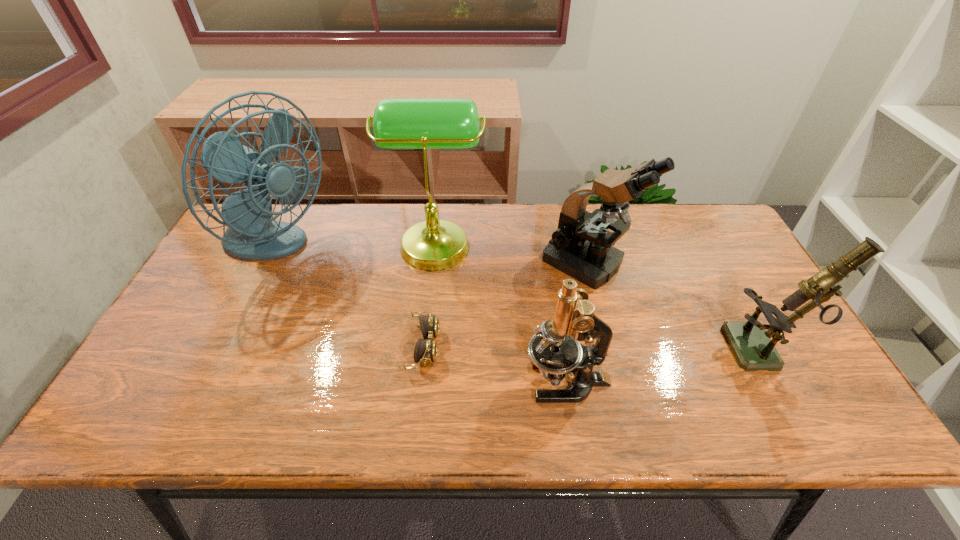
Select which microscope appears as the second closest to the farthest microscope. Please provide its 2D coordinates. Your answer should be formatted as a tuple, i.e. [(x, y)], where the tuple contains the x and y coordinates of a point satisfying the conditions above.

[(554, 349)]

Select which microscope is the second closest to the farthest microscope. Please provide its 2D coordinates. Your answer should be formatted as a tuple, i.e. [(x, y)], where the tuple contains the x and y coordinates of a point satisfying the conditions above.

[(554, 349)]

What are the coordinates of `blank area in the image that satisfies the following two spatial constraints: 1. in front of the leftmost object to blow air; 2. on the left side of the farthest microscope` in the screenshot? It's located at (269, 264).

Locate an element on the screen. The width and height of the screenshot is (960, 540). free spot that satisfies the following two spatial constraints: 1. on the desk next to the lamp; 2. on the right side of the farthest microscope is located at coordinates (433, 264).

You are a GUI agent. You are given a task and a screenshot of the screen. Output one action in this format:
    pyautogui.click(x=<x>, y=<y>)
    Task: Click on the free location that satisfies the following two spatial constraints: 1. in front of the fan to blow air; 2. on the right side of the farthest microscope
    The width and height of the screenshot is (960, 540).
    Given the screenshot: What is the action you would take?
    point(269,264)